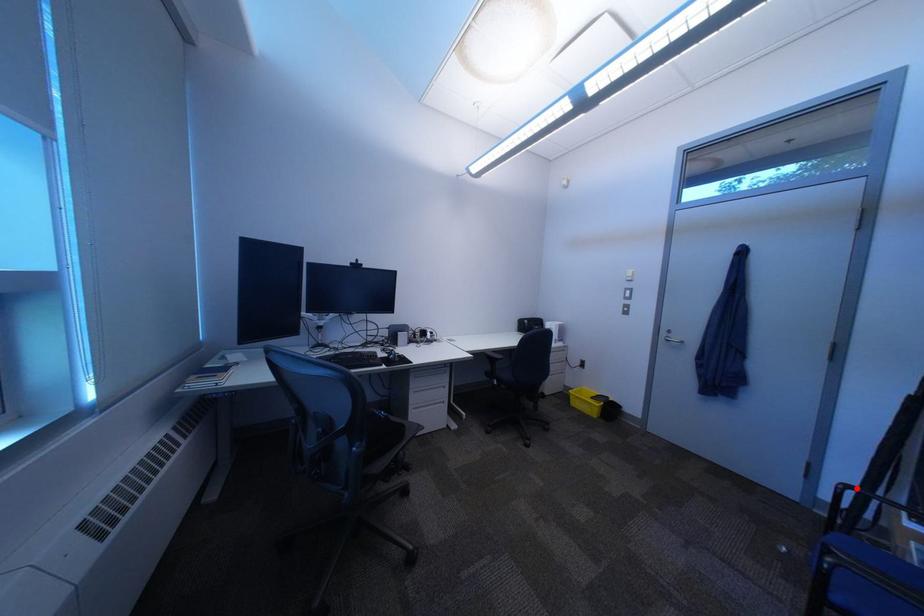
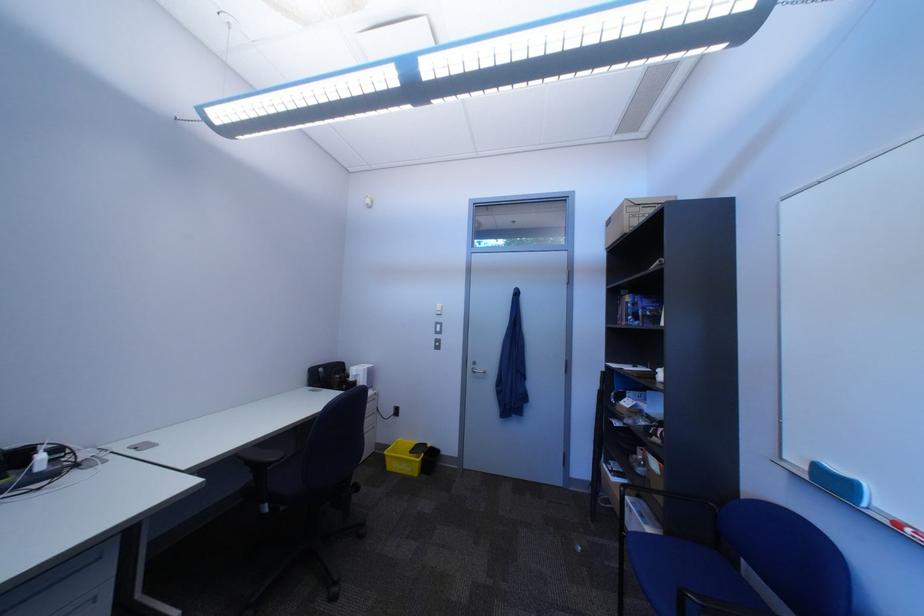
Where in the second image is the point corresponding to the highlighted location from the first image?

(638, 491)